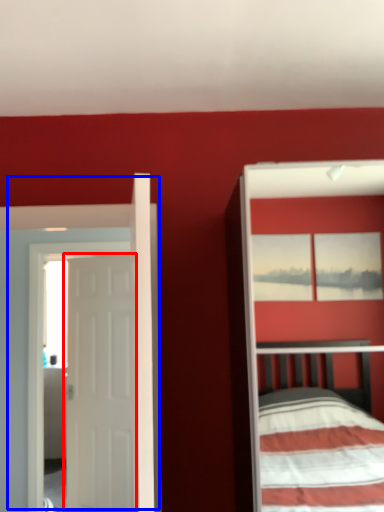
Question: Which point is closer to the camera, door (highlighted by a red box) or door (highlighted by a blue box)?

Choices:
 (A) door
 (B) door

Answer: (B)